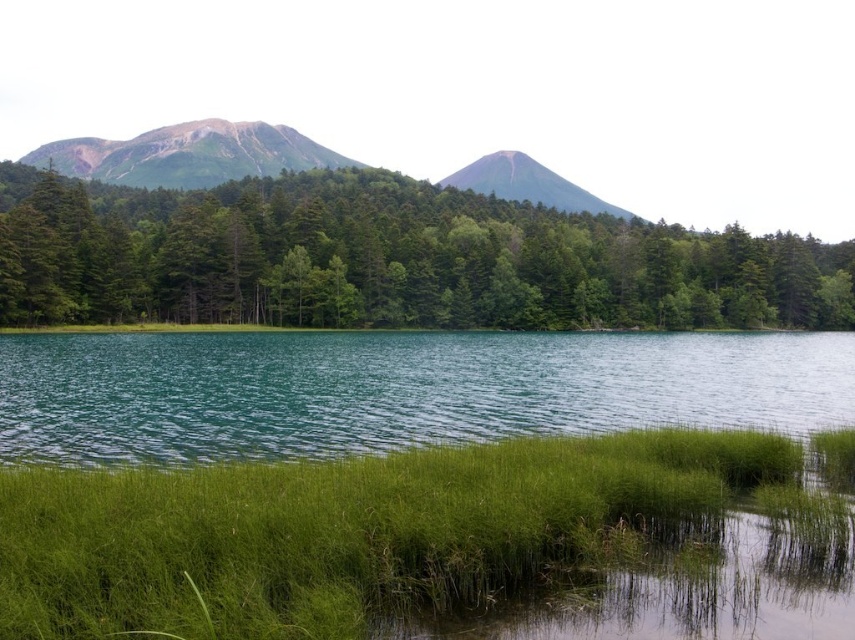
Between point (329, 150) and point (511, 189), which one is positioned behind?

Positioned behind is point (329, 150).

Consider the image. Who is higher up, rugged granite mountain at upper left or smooth gray mountain at center?

rugged granite mountain at upper left is above.

Is point (80, 150) positioned behind point (528, 189)?

Yes, it is.

Find the location of a particular element. This screenshot has height=640, width=855. rugged granite mountain at upper left is located at coordinates (187, 154).

What do you see at coordinates (357, 531) in the screenshot? I see `green soft grass at lower center` at bounding box center [357, 531].

Is green soft grass at lower center above teal glossy water at center?

No.

What do you see at coordinates (357, 531) in the screenshot?
I see `green soft grass at lower center` at bounding box center [357, 531].

Locate an element on the screen. The width and height of the screenshot is (855, 640). green soft grass at lower center is located at coordinates (357, 531).

Which of these two, teal glossy water at center or rugged granite mountain at upper left, stands shorter?

teal glossy water at center is shorter.

Which of these two, teal glossy water at center or rugged granite mountain at upper left, stands taller?

Standing taller between the two is rugged granite mountain at upper left.

Find the location of a particular element. Image resolution: width=855 pixels, height=640 pixels. teal glossy water at center is located at coordinates tap(398, 388).